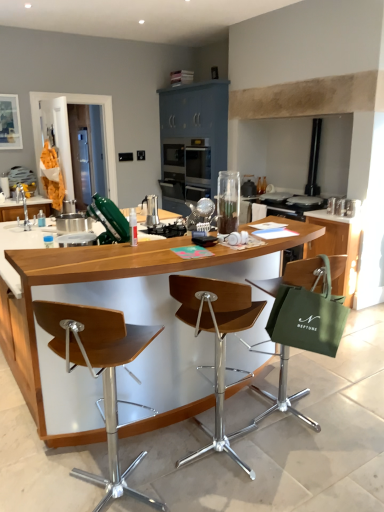
The image size is (384, 512). I want to click on space that is in front of wooden seat at center, which appears as the 2th chair when viewed from the left, so click(x=231, y=497).